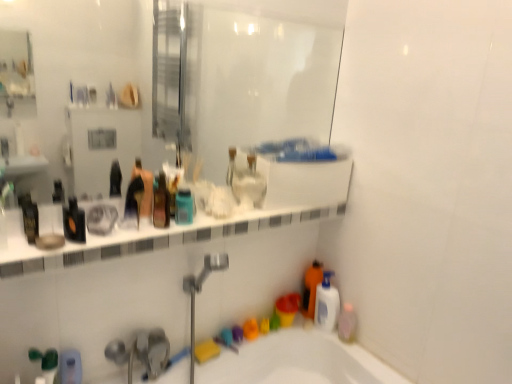
What is the approximate width of translucent plastic bottle at lower right?

The width of translucent plastic bottle at lower right is 3.43 inches.

Image resolution: width=512 pixels, height=384 pixels. In order to click on transparent glass mirror at upper center in this screenshot , I will do `click(261, 76)`.

Describe the element at coordinates (261, 76) in the screenshot. I see `transparent glass mirror at upper center` at that location.

How much space does teal plastic mouthwash at center, which ranks as the 3th mouthwash in back-to-front order, occupy vertically?

teal plastic mouthwash at center, which ranks as the 3th mouthwash in back-to-front order, is 11.69 centimeters tall.

In order to face pink translucent bottle at lower right, acting as the 5th mouthwash starting from the left, should I rotate leftwards or rightwards?

It's best to rotate right around 12.186 degrees.

How much space does translucent plastic soap dispenser at lower left, the first toiletry in the left-to-right sequence, occupy horizontally?

0.77 inches.

I want to click on translucent plastic bottle at lower right, so click(x=311, y=288).

Does translucent plastic soap dispenser at lower left, the 3th toiletry viewed from the top, come behind pink translucent bottle at lower right, acting as the 5th mouthwash starting from the left?

No, translucent plastic soap dispenser at lower left, the 3th toiletry viewed from the top, is closer to the viewer.

How many degrees apart are the facing directions of translucent plastic soap dispenser at lower left, the 3th toiletry viewed from the top, and pink translucent bottle at lower right, acting as the 5th mouthwash starting from the left?

The angular difference between translucent plastic soap dispenser at lower left, the 3th toiletry viewed from the top, and pink translucent bottle at lower right, acting as the 5th mouthwash starting from the left, is 67.6 degrees.

From the picture: Is translucent plastic soap dispenser at lower left, the 3th toiletry viewed from the top, not within pink translucent bottle at lower right, which is the 1th mouthwash in right-to-left order?

translucent plastic soap dispenser at lower left, the 3th toiletry viewed from the top, lies outside pink translucent bottle at lower right, which is the 1th mouthwash in right-to-left order,'s area.

From a real-world perspective, between translucent plastic soap dispenser at lower left, the first toiletry in the bottom-to-top sequence, and pink translucent bottle at lower right, acting as the 5th mouthwash starting from the left, who is vertically lower?

In real-world perspective, pink translucent bottle at lower right, acting as the 5th mouthwash starting from the left, is lower.

Who is taller, transparent glass mirror at upper center or matte black bottle at center, positioned as the second toiletry in top-to-bottom order?

With more height is transparent glass mirror at upper center.

Is transparent glass mirror at upper center inside or outside of matte black bottle at center, positioned as the second toiletry in top-to-bottom order?

transparent glass mirror at upper center is outside matte black bottle at center, positioned as the second toiletry in top-to-bottom order.

Is point (51, 73) behind point (137, 221)?

That is True.

Considering the sizes of teal plastic mouthwash at center, the 3th mouthwash in the right-to-left sequence, and translucent plastic bottle at lower right in the image, is teal plastic mouthwash at center, the 3th mouthwash in the right-to-left sequence, bigger or smaller than translucent plastic bottle at lower right?

In the image, teal plastic mouthwash at center, the 3th mouthwash in the right-to-left sequence, appears to be smaller than translucent plastic bottle at lower right.

From a real-world perspective, is teal plastic mouthwash at center, the third mouthwash from the left, above or below translucent plastic bottle at lower right?

In terms of real-world spatial position, teal plastic mouthwash at center, the third mouthwash from the left, is above translucent plastic bottle at lower right.

Which of these two, teal plastic mouthwash at center, which ranks as the 3th mouthwash in back-to-front order, or translucent plastic bottle at lower right, is thinner?

teal plastic mouthwash at center, which ranks as the 3th mouthwash in back-to-front order.

From the image's perspective, which object appears higher, teal plastic mouthwash at center, the 3th mouthwash from the front, or translucent plastic bottle at lower right?

teal plastic mouthwash at center, the 3th mouthwash from the front, is shown above in the image.

Is white plastic mouthwash at lower right, the 4th mouthwash viewed from the left, shorter than translucent plastic mouthwash at center, which appears as the 2th mouthwash when viewed from the front?

No, white plastic mouthwash at lower right, the 4th mouthwash viewed from the left, is not shorter than translucent plastic mouthwash at center, which appears as the 2th mouthwash when viewed from the front.

From the image's perspective, which one is positioned lower, white plastic mouthwash at lower right, the 4th mouthwash viewed from the left, or translucent plastic mouthwash at center, which appears as the 2th mouthwash when viewed from the front?

white plastic mouthwash at lower right, the 4th mouthwash viewed from the left.

What's the angular difference between white plastic mouthwash at lower right, which is the second mouthwash in right-to-left order, and translucent plastic mouthwash at center, the second mouthwash in the left-to-right sequence,'s facing directions?

49.5 degrees.

Would you say white plastic mouthwash at lower right, acting as the first mouthwash starting from the back, is inside or outside translucent plastic mouthwash at center, which is the fourth mouthwash from right to left?

white plastic mouthwash at lower right, acting as the first mouthwash starting from the back, is spatially situated outside translucent plastic mouthwash at center, which is the fourth mouthwash from right to left.

From the image's perspective, who appears lower, matte plastic toothbrush at upper center, positioned as the 1th toiletry in top-to-bottom order, or translucent plastic soap dispenser at lower left, the first toiletry in the left-to-right sequence?

translucent plastic soap dispenser at lower left, the first toiletry in the left-to-right sequence, from the image's perspective.

Does matte plastic toothbrush at upper center, placed as the third toiletry when sorted from bottom to top, have a greater height compared to translucent plastic soap dispenser at lower left, the 3th toiletry viewed from the top?

Yes, matte plastic toothbrush at upper center, placed as the third toiletry when sorted from bottom to top, is taller than translucent plastic soap dispenser at lower left, the 3th toiletry viewed from the top.

From the translucent plastic soap dispenser at lower left, the first toiletry in the left-to-right sequence, count 2nd toiletry to the right and point to it. Please provide its 2D coordinates.

[(144, 188)]

Is matte plastic toothbrush at upper center, placed as the third toiletry when sorted from bottom to top, further to the viewer compared to translucent plastic soap dispenser at lower left, the 3th toiletry viewed from the top?

No, the depth of matte plastic toothbrush at upper center, placed as the third toiletry when sorted from bottom to top, is less than that of translucent plastic soap dispenser at lower left, the 3th toiletry viewed from the top.

Can you confirm if translucent plastic bottle at lower right is positioned to the left of matte black bottle at center, which appears as the 2th toiletry when viewed from the left?

In fact, translucent plastic bottle at lower right is to the right of matte black bottle at center, which appears as the 2th toiletry when viewed from the left.

Which is nearer, (318, 272) or (132, 203)?

Clearly, point (318, 272) is more distant from the camera than point (132, 203).

Relative to matte black bottle at center, positioned as the second toiletry in top-to-bottom order, is translucent plastic bottle at lower right in front or behind?

Visually, translucent plastic bottle at lower right is located behind matte black bottle at center, positioned as the second toiletry in top-to-bottom order.

From the image's perspective, is translucent plastic bottle at lower right on matte black bottle at center, which appears as the 2th toiletry when viewed from the left?

No, from the image's perspective, translucent plastic bottle at lower right is not over matte black bottle at center, which appears as the 2th toiletry when viewed from the left.

In order to click on the 3rd mouthwash positioned above the white glossy ledge at upper center (from the image's perspective) in this screenshot , I will do `click(161, 202)`.

How different are the orientations of translucent plastic mouthwash at center, positioned as the 4th mouthwash in back-to-front order, and white glossy ledge at upper center in degrees?

translucent plastic mouthwash at center, positioned as the 4th mouthwash in back-to-front order, and white glossy ledge at upper center are facing 29.2 degrees away from each other.

Which of these two, translucent plastic mouthwash at center, positioned as the 4th mouthwash in back-to-front order, or white glossy ledge at upper center, is wider?

white glossy ledge at upper center is wider.

Is translucent plastic mouthwash at center, which appears as the 2th mouthwash when viewed from the front, bigger or smaller than white glossy ledge at upper center?

translucent plastic mouthwash at center, which appears as the 2th mouthwash when viewed from the front, is smaller than white glossy ledge at upper center.

This screenshot has height=384, width=512. I want to click on the 1st toiletry in front of the pink translucent bottle at lower right, positioned as the 4th mouthwash in front-to-back order, starting your count from the anchor, so click(x=70, y=367).

The image size is (512, 384). Find the location of `toiletry that is the 2nd one when counting leftward from the transparent glass mirror at upper center`. toiletry that is the 2nd one when counting leftward from the transparent glass mirror at upper center is located at coordinates (133, 203).

From the image, which object appears to be farther from white plastic mouthwash at lower right, the 4th mouthwash viewed from the left, translucent plastic soap dispenser at lower left, which appears as the third toiletry when viewed from the right, or white glossy ledge at upper center?

translucent plastic soap dispenser at lower left, which appears as the third toiletry when viewed from the right, is positioned further to the anchor white plastic mouthwash at lower right, the 4th mouthwash viewed from the left.

From the image, which object appears to be farther from translucent plastic soap dispenser at lower left, the 3th toiletry viewed from the top, matte black bottle at center, which appears as the 2th toiletry when viewed from the left, or translucent plastic mouthwash at center, which appears as the 2th mouthwash when viewed from the front?

translucent plastic mouthwash at center, which appears as the 2th mouthwash when viewed from the front, is positioned further to the anchor translucent plastic soap dispenser at lower left, the 3th toiletry viewed from the top.

Considering their positions, is translucent plastic soap dispenser at lower left, the 3th toiletry viewed from the top, positioned further to black glossy bottle at left, the 1th mouthwash viewed from the left, than matte plastic toothbrush at upper center, the first toiletry viewed from the right?

translucent plastic soap dispenser at lower left, the 3th toiletry viewed from the top, is positioned further to the anchor black glossy bottle at left, the 1th mouthwash viewed from the left.

Based on their spatial positions, is translucent plastic mouthwash at center, which appears as the 2th mouthwash when viewed from the front, or matte black bottle at center, positioned as the second toiletry in top-to-bottom order, further from pink translucent bottle at lower right, positioned as the 4th mouthwash in front-to-back order?

matte black bottle at center, positioned as the second toiletry in top-to-bottom order.

Looking at the image, which one is located closer to matte plastic toothbrush at upper center, which is the 3th toiletry in left-to-right order, transparent glass mirror at upper center or matte black bottle at center, marked as the second toiletry in a right-to-left arrangement?

Among the two, matte black bottle at center, marked as the second toiletry in a right-to-left arrangement, is located nearer to matte plastic toothbrush at upper center, which is the 3th toiletry in left-to-right order.

From the image, which object appears to be nearer to translucent plastic soap dispenser at lower left, the 3th toiletry viewed from the top, pink translucent bottle at lower right, which is the 1th mouthwash in right-to-left order, or white glossy ledge at upper center?

white glossy ledge at upper center.

From the image, which object appears to be nearer to translucent plastic bottle at lower right, matte black bottle at center, positioned as the second toiletry in top-to-bottom order, or black glossy bottle at left, which is counted as the first mouthwash, starting from the front?

matte black bottle at center, positioned as the second toiletry in top-to-bottom order.

Which object lies nearer to the anchor point transparent glass mirror at upper center, matte black bottle at center, positioned as the second toiletry in top-to-bottom order, or teal plastic mouthwash at center, which ranks as the 3th mouthwash in back-to-front order?

The object closer to transparent glass mirror at upper center is matte black bottle at center, positioned as the second toiletry in top-to-bottom order.

Image resolution: width=512 pixels, height=384 pixels. What are the coordinates of `mouthwash between black glossy bottle at left, positioned as the 5th mouthwash in right-to-left order, and teal plastic mouthwash at center, which ranks as the 3th mouthwash in back-to-front order` in the screenshot? It's located at (161, 202).

The height and width of the screenshot is (384, 512). I want to click on cleaning product situated between translucent plastic soap dispenser at lower left, the 3th toiletry viewed from the top, and pink translucent bottle at lower right, positioned as the 4th mouthwash in front-to-back order, from left to right, so pos(311,288).

You are a GUI agent. You are given a task and a screenshot of the screen. Output one action in this format:
    pyautogui.click(x=<x>, y=<y>)
    Task: Click on the cleaning product between transparent glass mirror at upper center and pink translucent bottle at lower right, placed as the 2th mouthwash when sorted from back to front, in the up-down direction
    The image size is (512, 384).
    Given the screenshot: What is the action you would take?
    pyautogui.click(x=311, y=288)

The width and height of the screenshot is (512, 384). What are the coordinates of `cleaning product between teal plastic mouthwash at center, the 3th mouthwash in the right-to-left sequence, and pink translucent bottle at lower right, acting as the 5th mouthwash starting from the left, from left to right` in the screenshot? It's located at (311, 288).